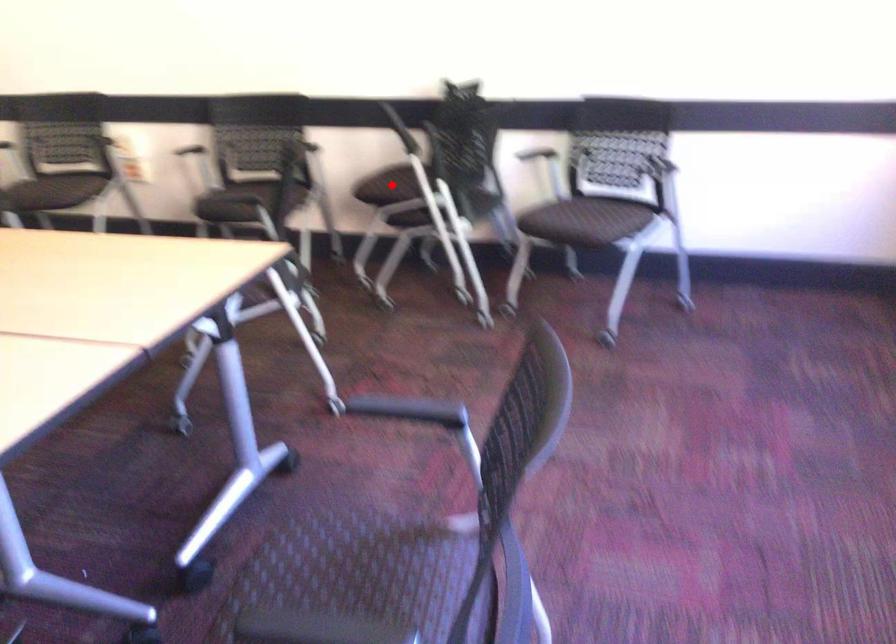
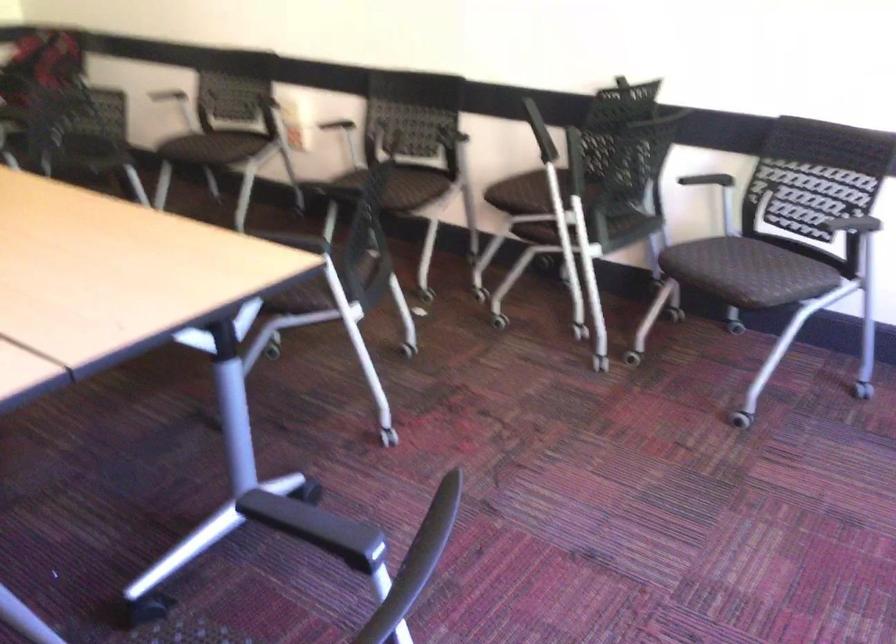
In the second image, find the point that corresponds to the highlighted location in the first image.

(526, 193)